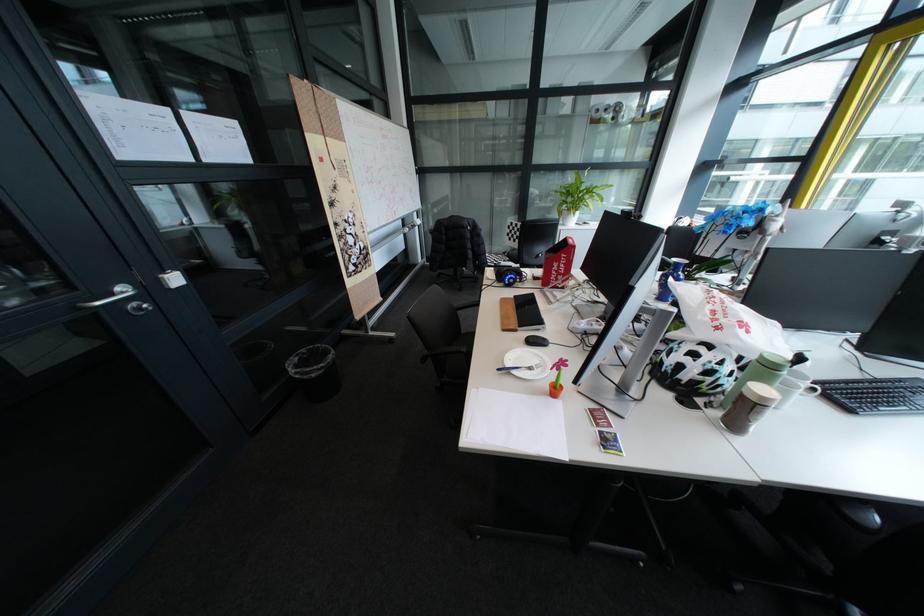
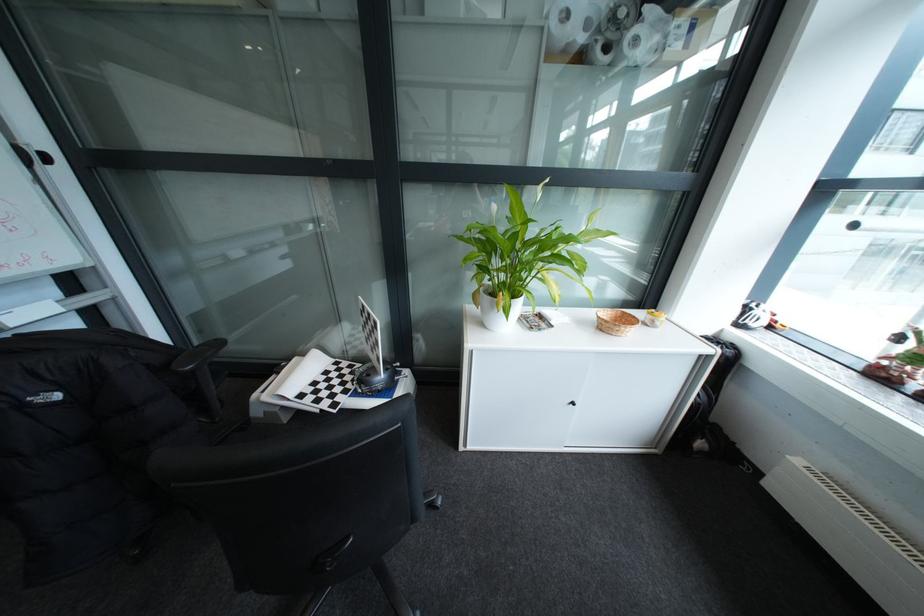
What movement of the cameraman would produce the second image?

The cameraman moved toward right, forward.